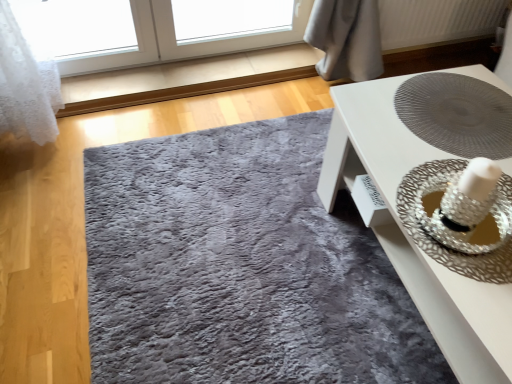
Question: From a real-world perspective, is white textured radiator at upper right beneath white glossy table at center?

Choices:
 (A) yes
 (B) no

Answer: (B)

Question: Is white textured radiator at upper right positioned in front of white glossy table at center?

Choices:
 (A) yes
 (B) no

Answer: (B)

Question: Does white textured radiator at upper right have a lesser width compared to white glossy table at center?

Choices:
 (A) no
 (B) yes

Answer: (B)

Question: Can you confirm if white textured radiator at upper right is bigger than white glossy table at center?

Choices:
 (A) no
 (B) yes

Answer: (A)

Question: Considering the relative sizes of white textured radiator at upper right and white glossy table at center in the image provided, is white textured radiator at upper right wider than white glossy table at center?

Choices:
 (A) yes
 (B) no

Answer: (B)

Question: Can white glossy table at center be found inside white textured radiator at upper right?

Choices:
 (A) no
 (B) yes

Answer: (A)

Question: Could you tell me if shaggy gray rug at center is facing white glossy table at center?

Choices:
 (A) no
 (B) yes

Answer: (A)

Question: Would you say shaggy gray rug at center is outside white glossy table at center?

Choices:
 (A) yes
 (B) no

Answer: (A)

Question: Would you say white glossy table at center is part of shaggy gray rug at center's contents?

Choices:
 (A) no
 (B) yes

Answer: (A)

Question: Considering the relative sizes of shaggy gray rug at center and white glossy table at center in the image provided, is shaggy gray rug at center bigger than white glossy table at center?

Choices:
 (A) no
 (B) yes

Answer: (A)

Question: Is shaggy gray rug at center touching white glossy table at center?

Choices:
 (A) yes
 (B) no

Answer: (B)

Question: Can you confirm if shaggy gray rug at center is thinner than white glossy table at center?

Choices:
 (A) yes
 (B) no

Answer: (B)

Question: Is shaggy gray rug at center located within white textured radiator at upper right?

Choices:
 (A) yes
 (B) no

Answer: (B)